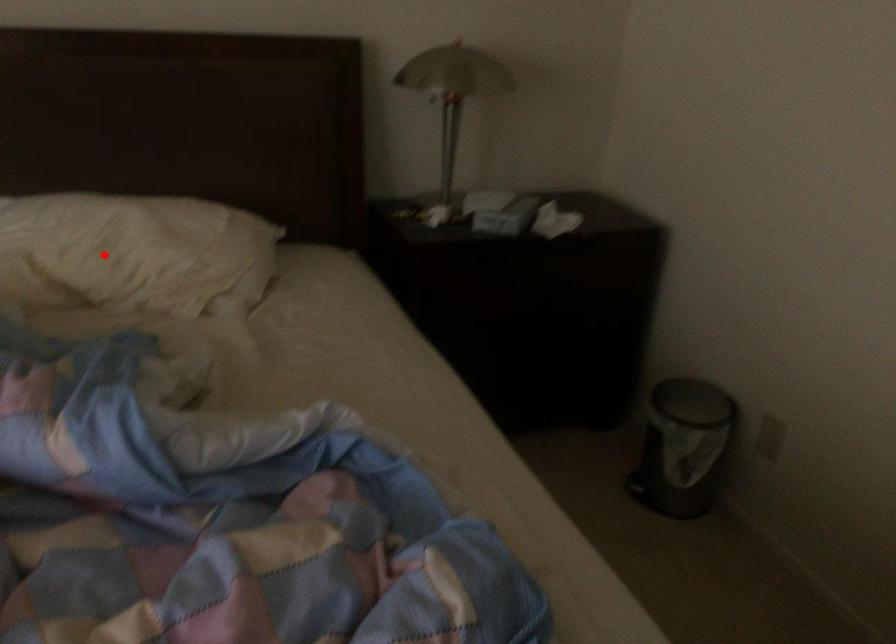
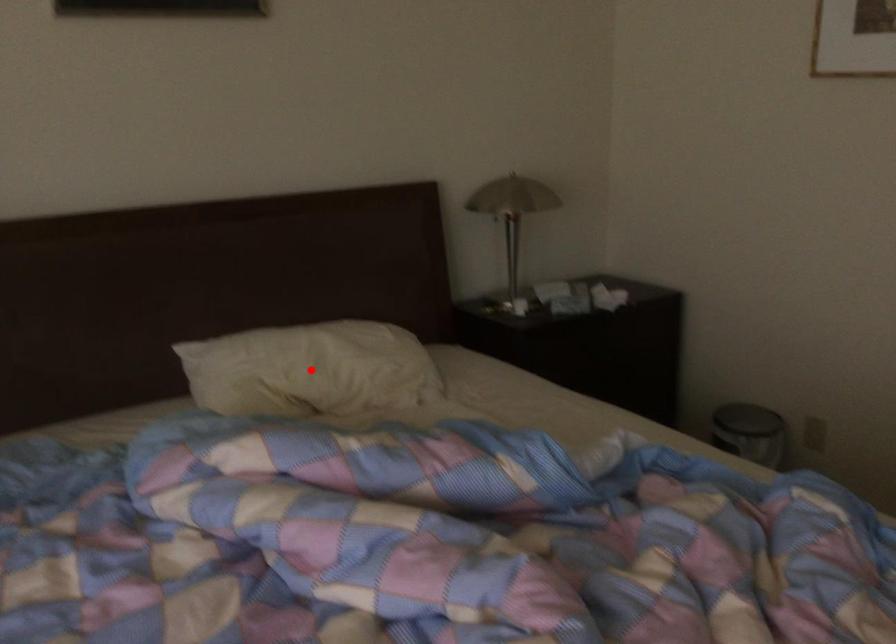
I am providing you with two images of the same scene from different viewpoints. A red point is marked on the first image and another point is marked on the second image. Is the marked point in image1 the same physical position as the marked point in image2?

Yes